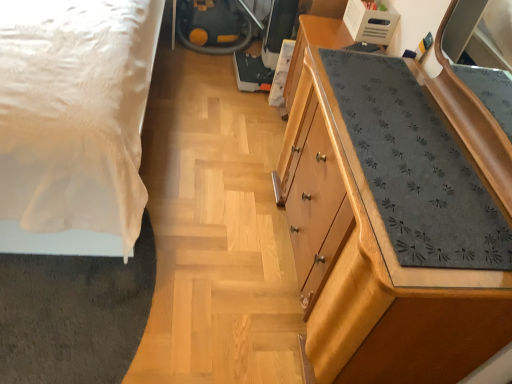
Image resolution: width=512 pixels, height=384 pixels. Identify the location of free space above wooden dresser at right (from a real-world perspective). (425, 180).